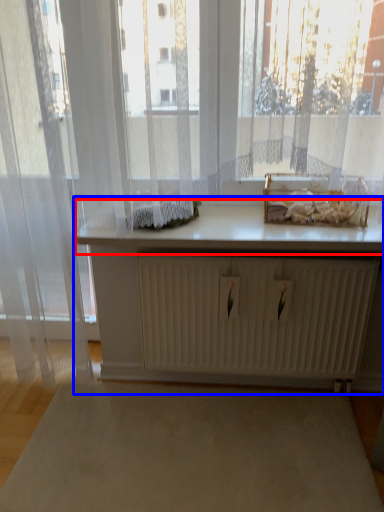
Question: Which of the following is the closest to the observer, counter top (highlighted by a red box) or table (highlighted by a blue box)?

Choices:
 (A) counter top
 (B) table

Answer: (A)